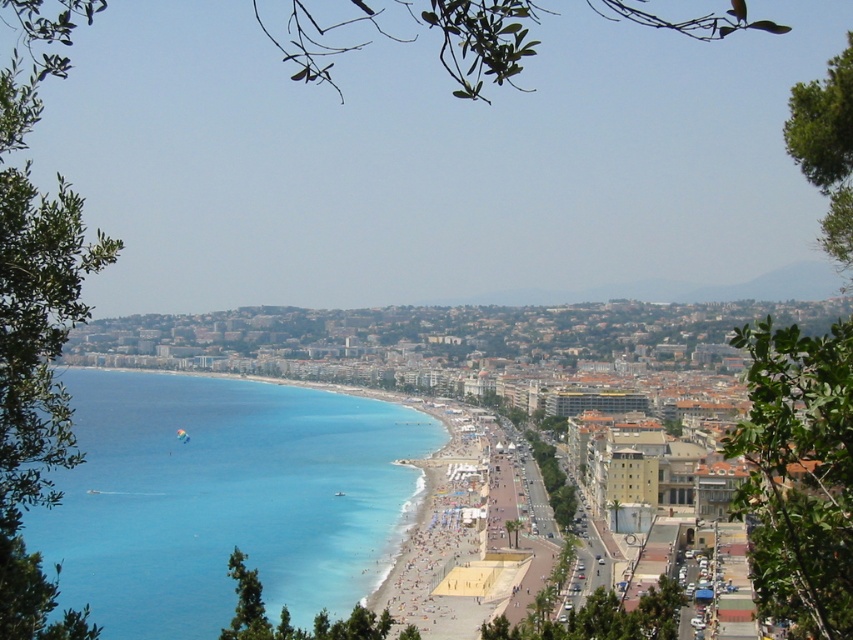
You are a photographer standing at the center of the beach, aiming to capture the blue clear water at lower left in your shot. Based on the coordinates provided, which direction should you move to ensure the water is centered in your frame?

The blue clear water at lower left is located at coordinates point (223, 499). To center it in your frame, you should move towards the lower left direction from your current position at the center of the beach.

You are standing on the elevated hillside overlooking the beach. You want to take a photo of the blue clear water at lower left and the beige sand beach at center. Which object should you focus on first if you want to capture both in one frame without moving the camera?

You should focus on the blue clear water at lower left first because it is closer to the viewer than the beige sand beach at center, so adjusting focus from near to far will help capture both in one frame.

You are a photographer standing on the hillside overlooking the beach and city. You want to capture a photo that includes both the blue clear water at lower left and the beige sand beach at center. Which object will appear larger in your photo?

The blue clear water at lower left will appear larger in the photo because it is much taller than the beige sand beach at center.